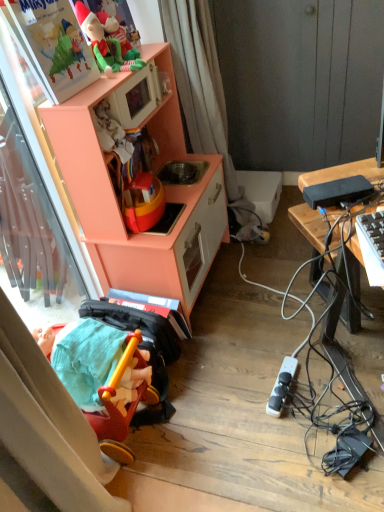
Question: From the image's perspective, is black plastic power bank at right, the first appliance positioned from the front, beneath black plastic power strip at lower right, acting as the 2th appliance starting from the top?

Choices:
 (A) no
 (B) yes

Answer: (A)

Question: Is black plastic power bank at right, the first appliance in the top-to-bottom sequence, oriented away from black plastic power strip at lower right, acting as the 2th appliance starting from the top?

Choices:
 (A) yes
 (B) no

Answer: (B)

Question: Considering the relative sizes of black plastic power bank at right, the second appliance when ordered from back to front, and black plastic power strip at lower right, acting as the 1th appliance starting from the back, in the image provided, is black plastic power bank at right, the second appliance when ordered from back to front, smaller than black plastic power strip at lower right, acting as the 1th appliance starting from the back,?

Choices:
 (A) yes
 (B) no

Answer: (B)

Question: Is black plastic power bank at right, acting as the second appliance starting from the bottom, not close to black plastic power strip at lower right, acting as the 2th appliance starting from the front?

Choices:
 (A) yes
 (B) no

Answer: (B)

Question: Are black plastic power bank at right, the second appliance when ordered from back to front, and black plastic power strip at lower right, acting as the 2th appliance starting from the top, making contact?

Choices:
 (A) yes
 (B) no

Answer: (B)

Question: Is the depth of black plastic power bank at right, the first appliance positioned from the front, greater than that of black plastic power strip at lower right, acting as the 1th appliance starting from the back?

Choices:
 (A) yes
 (B) no

Answer: (B)

Question: Considering the relative sizes of matte plastic elf at upper left, the 2th toy ordered from the bottom, and black plastic desk at right in the image provided, is matte plastic elf at upper left, the 2th toy ordered from the bottom, thinner than black plastic desk at right?

Choices:
 (A) no
 (B) yes

Answer: (B)

Question: Would you say black plastic desk at right is part of matte plastic elf at upper left, the 2th toy ordered from the bottom,'s contents?

Choices:
 (A) no
 (B) yes

Answer: (A)

Question: Could you tell me if matte plastic elf at upper left, which is counted as the 1th toy, starting from the top, is facing black plastic desk at right?

Choices:
 (A) no
 (B) yes

Answer: (A)

Question: Considering the relative sizes of matte plastic elf at upper left, which is counted as the 1th toy, starting from the top, and black plastic desk at right in the image provided, is matte plastic elf at upper left, which is counted as the 1th toy, starting from the top, wider than black plastic desk at right?

Choices:
 (A) yes
 (B) no

Answer: (B)

Question: From a real-world perspective, is matte plastic elf at upper left, the 2th toy ordered from the bottom, located beneath black plastic desk at right?

Choices:
 (A) yes
 (B) no

Answer: (B)

Question: Is matte plastic elf at upper left, which is counted as the 1th toy, starting from the top, located outside black plastic desk at right?

Choices:
 (A) no
 (B) yes

Answer: (B)

Question: Are matte plastic elf at upper left, which is counted as the 1th toy, starting from the top, and peach wood toy kitchen at left far apart?

Choices:
 (A) no
 (B) yes

Answer: (A)